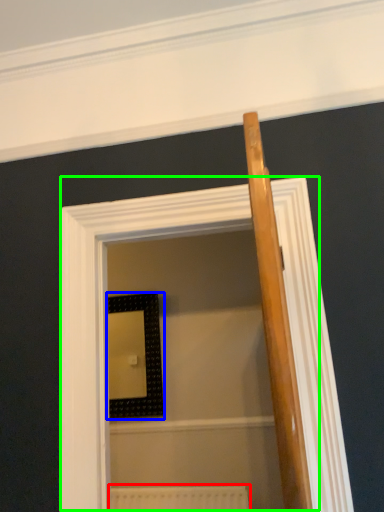
Question: Considering the real-world distances, which object is closest to radiator (highlighted by a red box)? picture frame (highlighted by a blue box) or screen door (highlighted by a green box).

Choices:
 (A) picture frame
 (B) screen door

Answer: (A)